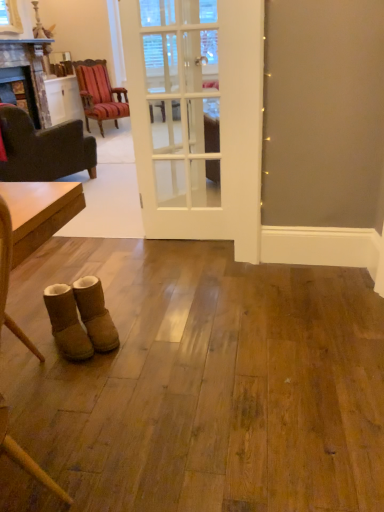
Question: Is dark brown fabric armchair at left, the 1th chair in the front-to-back sequence, spatially inside marble fireplace at left, or outside of it?

Choices:
 (A) outside
 (B) inside

Answer: (A)

Question: From the image's perspective, is dark brown fabric armchair at left, the first chair ordered from the bottom, located above or below marble fireplace at left?

Choices:
 (A) above
 (B) below

Answer: (B)

Question: Based on their relative distances, which object is nearer to the white glass door at center?

Choices:
 (A) wooden polished table at left
 (B) suede boots at lower left, which ranks as the first footwear in left-to-right order
 (C) marble fireplace at left
 (D) striped fabric chair at upper left, positioned as the 1th chair in back-to-front order
 (E) dark brown fabric armchair at left, the first chair ordered from the bottom

Answer: (B)

Question: Estimate the real-world distances between objects in this image. Which object is farther from the marble fireplace at left?

Choices:
 (A) suede boots at lower left, the 1th footwear in the right-to-left sequence
 (B) white glass door at center
 (C) suede boots at lower left, acting as the second footwear starting from the right
 (D) dark brown fabric armchair at left, placed as the second chair when sorted from top to bottom
 (E) wooden polished table at left

Answer: (E)